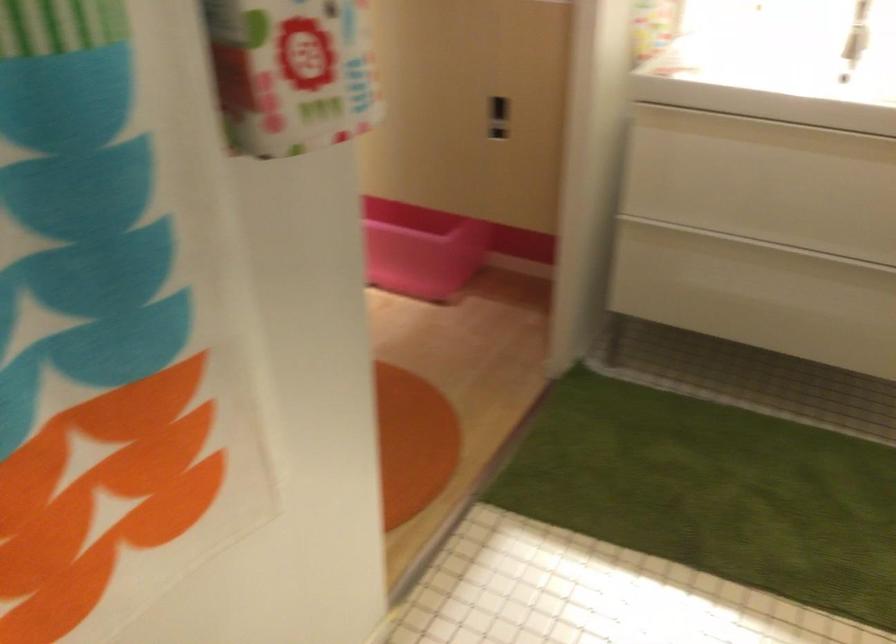
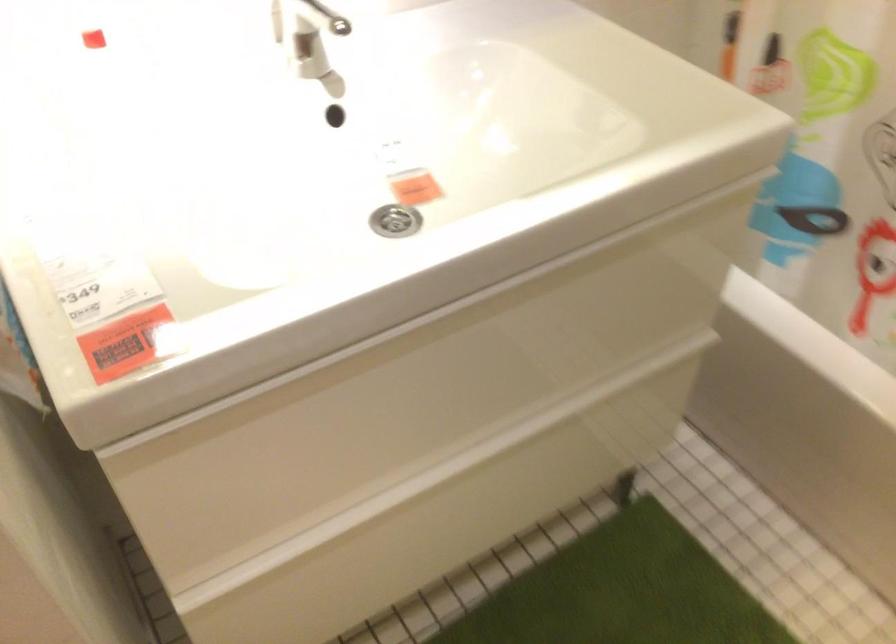
Locate, in the second image, the point that corresponds to [761,275] in the first image.

(442, 514)